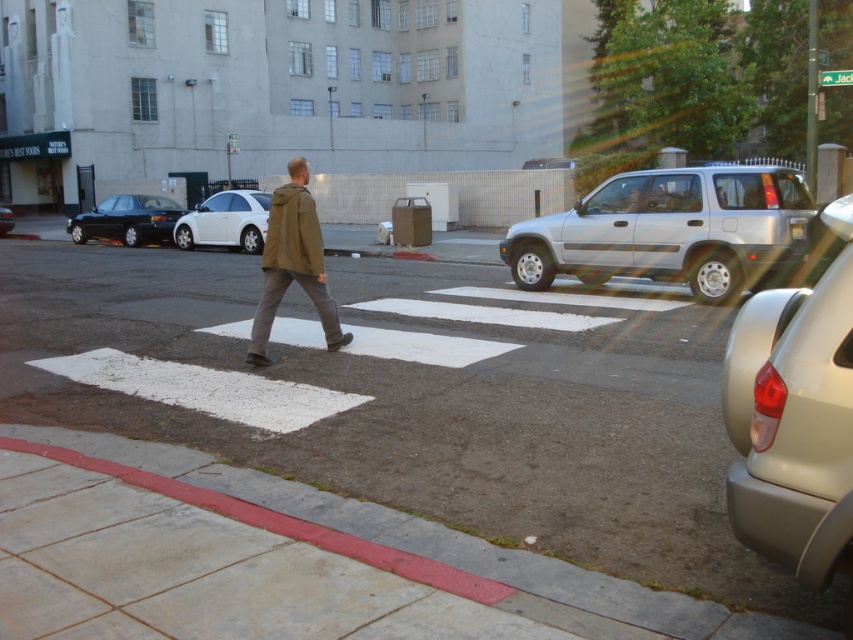
Does silver metallic suv at center-right lie in front of matte black sedan at center?

That is True.

Is point (613, 184) less distant than point (0, 221)?

Yes, point (613, 184) is closer to viewer.

Is point (605, 220) closer to camera compared to point (7, 218)?

Yes, it is in front of point (7, 218).

Identify the location of silver metallic suv at center-right. This screenshot has height=640, width=853. (670, 230).

Looking at this image, is olive-green fabric jacket at center to the right of matte black sedan at center from the viewer's perspective?

Indeed, olive-green fabric jacket at center is positioned on the right side of matte black sedan at center.

Is point (297, 246) closer to viewer compared to point (12, 227)?

Yes, it is in front of point (12, 227).

The width and height of the screenshot is (853, 640). What are the coordinates of `olive-green fabric jacket at center` in the screenshot? It's located at (293, 262).

Who is shorter, matte silver suv at right or silver metallic suv at center-right?

With less height is matte silver suv at right.

What do you see at coordinates (793, 417) in the screenshot? The image size is (853, 640). I see `matte silver suv at right` at bounding box center [793, 417].

Where is `matte silver suv at right`? matte silver suv at right is located at coordinates (793, 417).